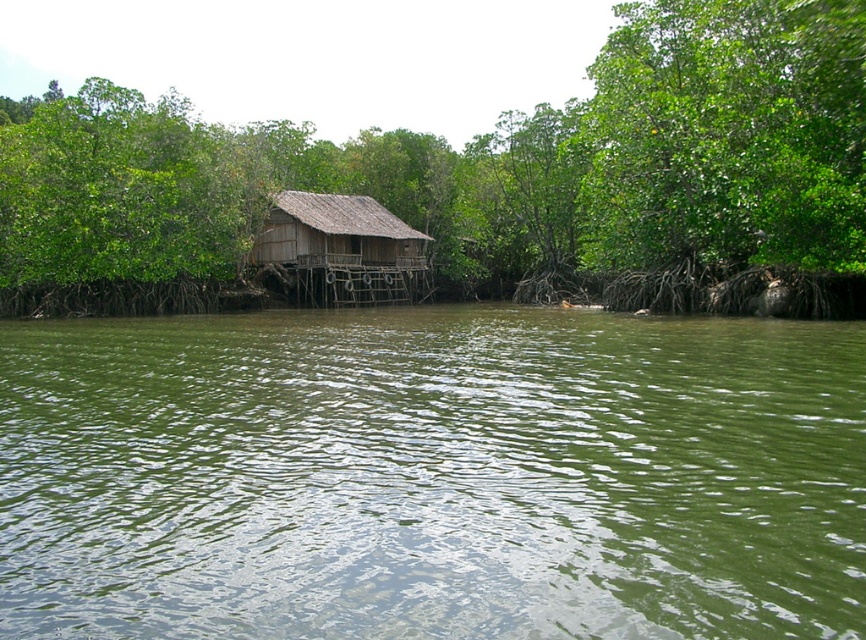
Is green water at center shorter than green leafy tree at center?

Correct, green water at center is not as tall as green leafy tree at center.

Is point (270, 417) positioned before point (412, 134)?

Yes, it is in front of point (412, 134).

This screenshot has width=866, height=640. I want to click on green water at center, so click(433, 476).

Which is in front, point (481, 456) or point (395, 289)?

Point (481, 456) is more forward.

Is point (843, 404) more distant than point (349, 232)?

That is False.

This screenshot has width=866, height=640. What do you see at coordinates (433, 476) in the screenshot?
I see `green water at center` at bounding box center [433, 476].

The width and height of the screenshot is (866, 640). In order to click on green water at center in this screenshot , I will do `click(433, 476)`.

Is point (799, 61) positioned in front of point (289, 214)?

Yes, point (799, 61) is in front of point (289, 214).

Between point (783, 209) and point (267, 214), which one is positioned behind?

The point (267, 214) is behind.

Does point (850, 253) lie in front of point (408, 273)?

That is True.

This screenshot has height=640, width=866. I want to click on green leafy tree at center, so click(483, 179).